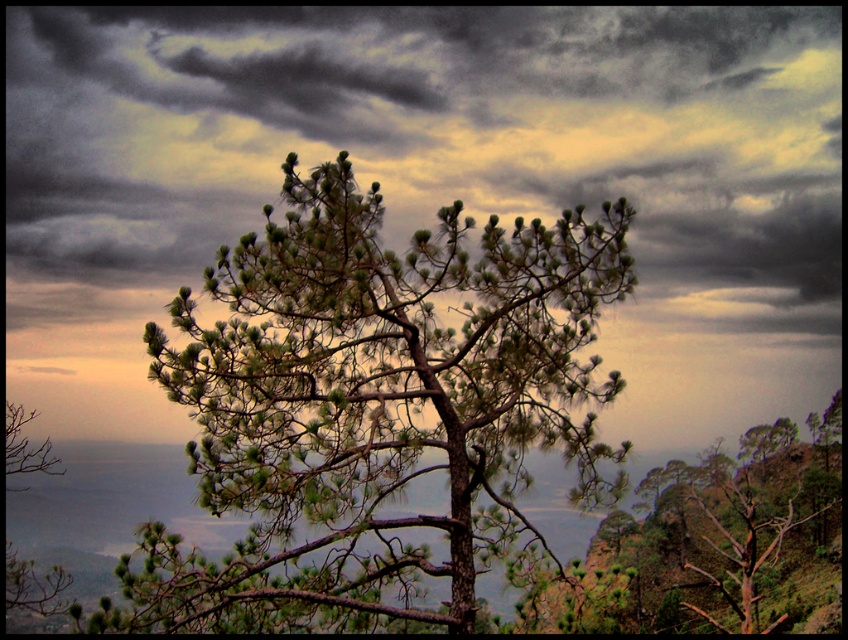
Question: Does dark gray cloud at upper center appear on the left side of green needle-like at center?

Choices:
 (A) no
 (B) yes

Answer: (A)

Question: Which object appears farthest from the camera in this image?

Choices:
 (A) dark gray cloud at upper center
 (B) green needle-like at center

Answer: (A)

Question: Does dark gray cloud at upper center appear on the right side of green needle-like at center?

Choices:
 (A) no
 (B) yes

Answer: (B)

Question: Which point appears closest to the camera in this image?

Choices:
 (A) (581, 224)
 (B) (722, 124)

Answer: (A)

Question: Is dark gray cloud at upper center positioned before green needle-like at center?

Choices:
 (A) yes
 (B) no

Answer: (B)